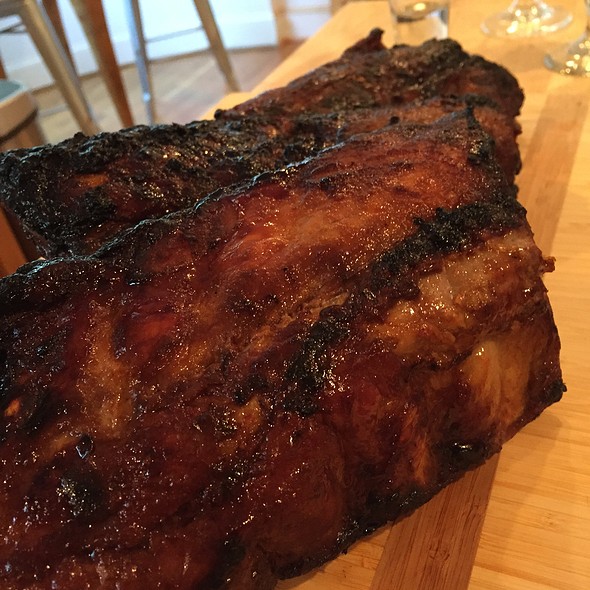
Find the location of a particular element. hardwood floor is located at coordinates (190, 91).